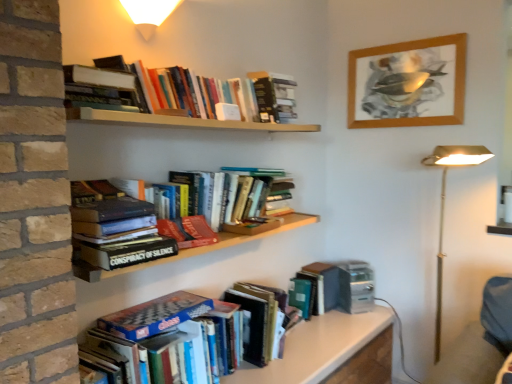
Question: Would you say white glossy table at lower center is inside or outside hardcover book at upper center, which is counted as the 1th book, starting from the top?

Choices:
 (A) inside
 (B) outside

Answer: (B)

Question: In the image, is white glossy table at lower center on the left side or the right side of hardcover book at upper center, which appears as the 7th book when ordered from the bottom?

Choices:
 (A) left
 (B) right

Answer: (B)

Question: Estimate the real-world distances between objects in this image. Which object is closer to the matte white wall sconce at upper center?

Choices:
 (A) hardcover books at upper center, the 6th book from the bottom
 (B) hardcover book at upper center, which appears as the 7th book when ordered from the bottom
 (C) hardcover book at upper left, the 3th book positioned from the top
 (D) wooden picture frame at upper right
 (E) blue glossy chess set at lower center, which is the 7th book from top to bottom

Answer: (A)

Question: Based on their relative distances, which object is farther from the hardcover book at center, which ranks as the fourth book in bottom-to-top order?

Choices:
 (A) blue glossy chess set at lower center, marked as the 1th book in a bottom-to-top arrangement
 (B) metallic gold floor lamp at right
 (C) hardcover books at upper center, which is counted as the second book, starting from the top
 (D) green matte book at lower center, arranged as the sixth book when viewed from the top
 (E) hardcover book at center, which is counted as the 3th book, starting from the bottom

Answer: (B)